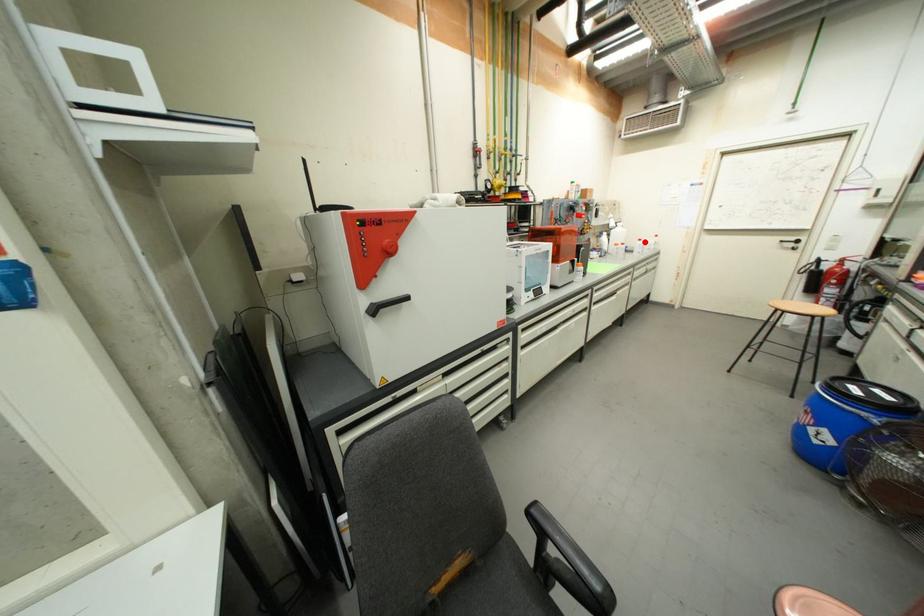
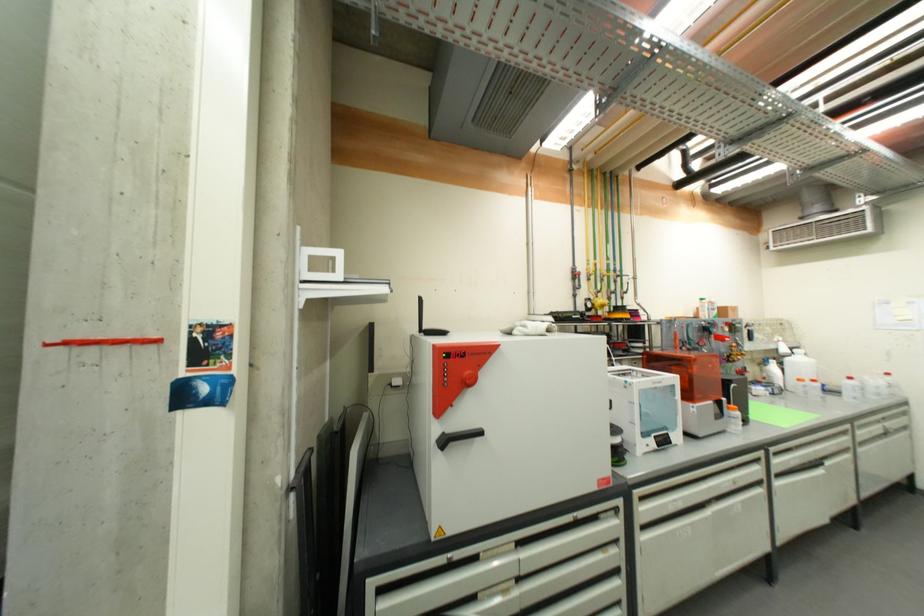
Where in the second image is the point corresponding to the highlighted location from the first image?

(856, 379)